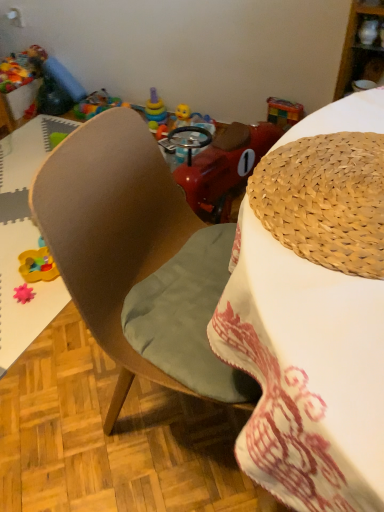
Based on the photo, in order to face translucent plastic sippy cup at center, acting as the 1th toy starting from the right, should I rotate leftwards or rightwards?

Turn right approximately 1.871 degrees to face it.

This screenshot has width=384, height=512. Describe the element at coordinates (361, 46) in the screenshot. I see `wooden cabinet at upper right` at that location.

Find the location of a particular element. Image resolution: width=384 pixels, height=512 pixels. translucent plastic sippy cup at center, the 3th toy in the left-to-right sequence is located at coordinates (202, 122).

Who is taller, brown wooden chair at center or pink rubber star at lower left, which is the 3th toy in right-to-left order?

With more height is pink rubber star at lower left, which is the 3th toy in right-to-left order.

Which of these two, brown wooden chair at center or pink rubber star at lower left, which is the 3th toy in right-to-left order, is thinner?

pink rubber star at lower left, which is the 3th toy in right-to-left order, is thinner.

What's the angular difference between brown wooden chair at center and pink rubber star at lower left, which is the 3th toy in right-to-left order,'s facing directions?

The angular difference between brown wooden chair at center and pink rubber star at lower left, which is the 3th toy in right-to-left order, is 81 degrees.

Which is behind, brown wooden chair at center or pink rubber star at lower left, which is the 3th toy in right-to-left order?

pink rubber star at lower left, which is the 3th toy in right-to-left order.

Between woven straw hat at upper right and translucent plastic sippy cup at center, which is the second toy from bottom to top, which one has less height?

With less height is woven straw hat at upper right.

Is woven straw hat at upper right turned away from translucent plastic sippy cup at center, acting as the 1th toy starting from the right?

No, translucent plastic sippy cup at center, acting as the 1th toy starting from the right, is not at the back of woven straw hat at upper right.

Is point (287, 220) less distant than point (201, 126)?

Yes, it is in front of point (201, 126).

Can you confirm if woven straw hat at upper right is smaller than translucent plastic sippy cup at center, acting as the 1th toy starting from the right?

No, woven straw hat at upper right is not smaller than translucent plastic sippy cup at center, acting as the 1th toy starting from the right.

Could you tell me if brown wooden chair at center is facing woven straw hat at upper right?

No, brown wooden chair at center does not turn towards woven straw hat at upper right.

How distant is brown wooden chair at center from woven straw hat at upper right?

A distance of 14.01 inches exists between brown wooden chair at center and woven straw hat at upper right.

Based on the photo, from a real-world perspective, who is located lower, brown wooden chair at center or woven straw hat at upper right?

In real-world perspective, brown wooden chair at center is lower.

From the image's perspective, does brown wooden chair at center appear higher than woven straw hat at upper right?

Indeed, from the image's perspective, brown wooden chair at center is shown above woven straw hat at upper right.

Can you confirm if rubberized plastic toy at upper left, placed as the third toy when sorted from front to back, is smaller than wooden cabinet at upper right?

Indeed, rubberized plastic toy at upper left, placed as the third toy when sorted from front to back, has a smaller size compared to wooden cabinet at upper right.

Is rubberized plastic toy at upper left, positioned as the 2th toy in right-to-left order, positioned far away from wooden cabinet at upper right?

rubberized plastic toy at upper left, positioned as the 2th toy in right-to-left order, is far away from wooden cabinet at upper right.

Is rubberized plastic toy at upper left, positioned as the 2th toy in right-to-left order, turned away from wooden cabinet at upper right?

No, rubberized plastic toy at upper left, positioned as the 2th toy in right-to-left order, is not facing away from wooden cabinet at upper right.

How much distance is there between rubberized plastic toy at upper left, the first toy in the back-to-front sequence, and wooden cabinet at upper right?

1.29 meters.

Is the position of rubberized plastic toy at upper left, the first toy positioned from the top, less distant than that of pink rubber star at lower left, which ranks as the 1th toy in front-to-back order?

No, rubberized plastic toy at upper left, the first toy positioned from the top, is further to the viewer.

From the image's perspective, would you say rubberized plastic toy at upper left, the first toy positioned from the top, is shown under pink rubber star at lower left, which appears as the third toy when viewed from the back?

No, from the image's perspective, rubberized plastic toy at upper left, the first toy positioned from the top, is not below pink rubber star at lower left, which appears as the third toy when viewed from the back.

Is rubberized plastic toy at upper left, placed as the third toy when sorted from front to back, to the left of pink rubber star at lower left, the 3th toy in the top-to-bottom sequence, from the viewer's perspective?

Incorrect, rubberized plastic toy at upper left, placed as the third toy when sorted from front to back, is not on the left side of pink rubber star at lower left, the 3th toy in the top-to-bottom sequence.

Is rubberized plastic toy at upper left, the first toy in the back-to-front sequence, at the right side of woven straw hat at upper right?

No.

Is woven straw hat at upper right surrounded by rubberized plastic toy at upper left, which appears as the third toy when ordered from the bottom?

No, woven straw hat at upper right is not a part of rubberized plastic toy at upper left, which appears as the third toy when ordered from the bottom.

From the picture: Is rubberized plastic toy at upper left, the first toy in the back-to-front sequence, placed right next to woven straw hat at upper right?

No, rubberized plastic toy at upper left, the first toy in the back-to-front sequence, is not with woven straw hat at upper right.

Is translucent plastic sippy cup at center, acting as the 2th toy starting from the back, not close to brown wooden chair at center?

No, translucent plastic sippy cup at center, acting as the 2th toy starting from the back, is not far away from brown wooden chair at center.

Is translucent plastic sippy cup at center, positioned as the second toy in front-to-back order, shorter than brown wooden chair at center?

No, translucent plastic sippy cup at center, positioned as the second toy in front-to-back order, is not shorter than brown wooden chair at center.

Considering the sizes of objects translucent plastic sippy cup at center, acting as the 1th toy starting from the right, and brown wooden chair at center in the image provided, who is bigger, translucent plastic sippy cup at center, acting as the 1th toy starting from the right, or brown wooden chair at center?

brown wooden chair at center is bigger.

Image resolution: width=384 pixels, height=512 pixels. Find the location of `the 1st toy behind the brown wooden chair at center, counting from the anchor's position`. the 1st toy behind the brown wooden chair at center, counting from the anchor's position is located at coordinates (23, 293).

The height and width of the screenshot is (512, 384). In order to click on toy that is the 1st one when counting upward from the woven straw hat at upper right (from the image's perspective) in this screenshot , I will do `click(202, 122)`.

Looking at the image, which one is located closer to wooden cabinet at upper right, brown wooden chair at center or pink rubber star at lower left, which is the first toy from left to right?

The object closer to wooden cabinet at upper right is brown wooden chair at center.

Estimate the real-world distances between objects in this image. Which object is closer to pink rubber star at lower left, which ranks as the 1th toy in front-to-back order, woven straw hat at upper right or brown wooden chair at center?

brown wooden chair at center is closer to pink rubber star at lower left, which ranks as the 1th toy in front-to-back order.

Looking at the image, which one is located closer to woven straw hat at upper right, pink rubber star at lower left, which appears as the first toy when ordered from the bottom, or wooden cabinet at upper right?

Based on the image, wooden cabinet at upper right appears to be nearer to woven straw hat at upper right.

Considering their positions, is woven straw hat at upper right positioned further to brown wooden chair at center than translucent plastic sippy cup at center, acting as the 2th toy starting from the back?

The object further to brown wooden chair at center is translucent plastic sippy cup at center, acting as the 2th toy starting from the back.

From the image, which object appears to be nearer to pink rubber star at lower left, which appears as the first toy when ordered from the bottom, rubberized plastic toy at upper left, positioned as the 2th toy in right-to-left order, or wooden cabinet at upper right?

The object closer to pink rubber star at lower left, which appears as the first toy when ordered from the bottom, is rubberized plastic toy at upper left, positioned as the 2th toy in right-to-left order.

Considering their positions, is woven straw hat at upper right positioned further to wooden cabinet at upper right than translucent plastic sippy cup at center, the 3th toy in the left-to-right sequence?

woven straw hat at upper right is further to wooden cabinet at upper right.

Considering their positions, is woven straw hat at upper right positioned closer to pink rubber star at lower left, which is the 3th toy in right-to-left order, than rubberized plastic toy at upper left, positioned as the 2th toy in right-to-left order?

woven straw hat at upper right lies closer to pink rubber star at lower left, which is the 3th toy in right-to-left order, than the other object.

From the image, which object appears to be farther from rubberized plastic toy at upper left, the first toy positioned from the top, translucent plastic sippy cup at center, acting as the 1th toy starting from the right, or wooden cabinet at upper right?

The object further to rubberized plastic toy at upper left, the first toy positioned from the top, is wooden cabinet at upper right.

What are the coordinates of `hat located between pink rubber star at lower left, which is the 3th toy in right-to-left order, and wooden cabinet at upper right in the left-right direction` in the screenshot? It's located at (325, 200).

Image resolution: width=384 pixels, height=512 pixels. I want to click on chair between woven straw hat at upper right and rubberized plastic toy at upper left, the first toy in the back-to-front sequence, in the front-back direction, so click(128, 252).

Identify the location of toy positioned between woven straw hat at upper right and translucent plastic sippy cup at center, acting as the 1th toy starting from the right, from near to far. (23, 293).

Find the location of `cabinetry located between woven straw hat at upper right and rubberized plastic toy at upper left, which ranks as the second toy in left-to-right order, in the depth direction`. cabinetry located between woven straw hat at upper right and rubberized plastic toy at upper left, which ranks as the second toy in left-to-right order, in the depth direction is located at coordinates (361, 46).